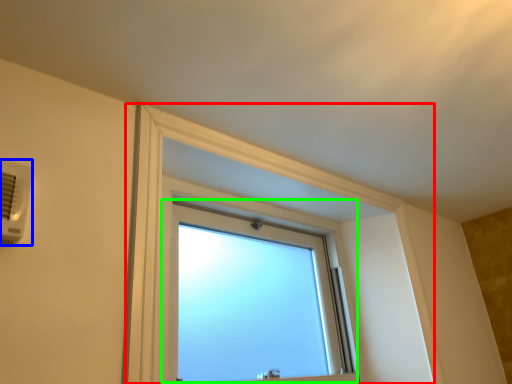
Question: Which is nearer to the bay window (highlighted by a red box)? air conditioning (highlighted by a blue box) or window (highlighted by a green box).

Choices:
 (A) air conditioning
 (B) window

Answer: (B)